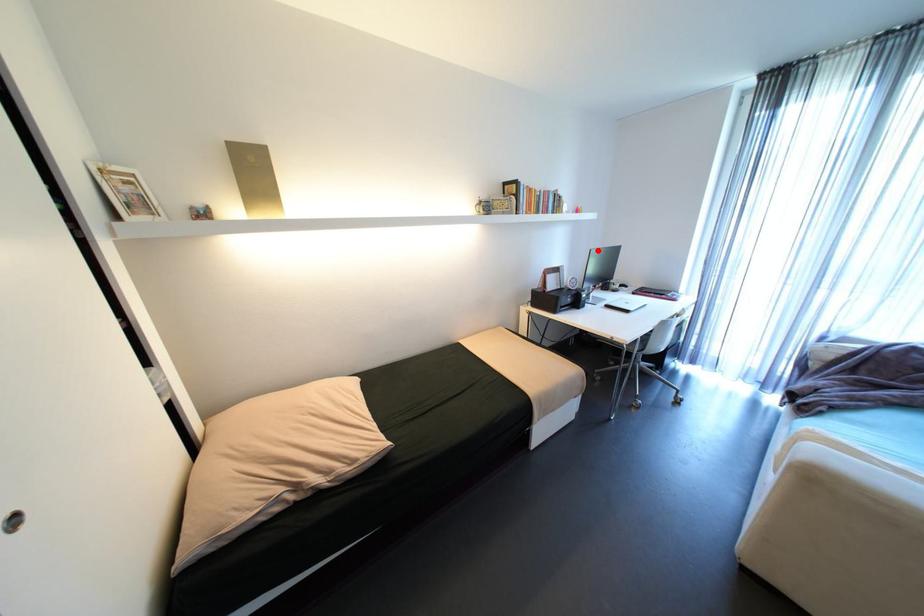
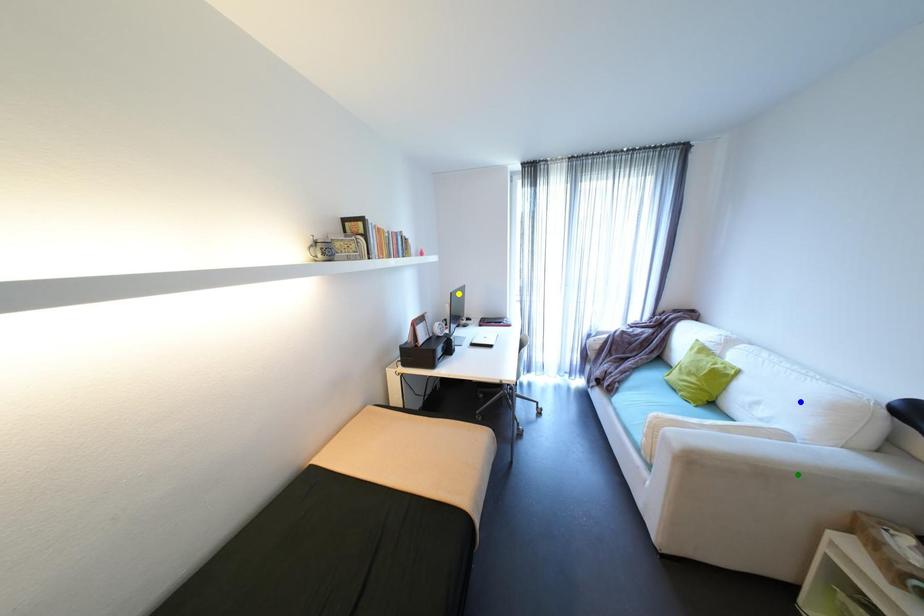
Question: I am providing you with two images of the same scene from different viewpoints. A red point is marked on the first image. You are given multiple points on the second image. Which spot in image 2 lines up with the point in image 1?

Choices:
 (A) blue point
 (B) green point
 (C) yellow point

Answer: (C)